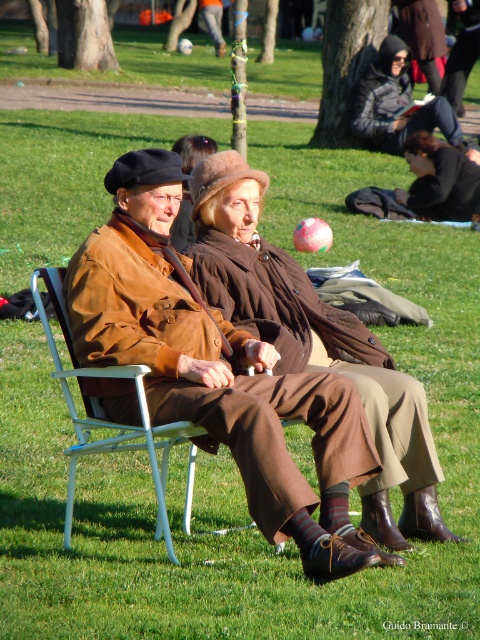
You are a photographer planning to take a group photo of the dark gray hooded jacket at center and the brown woolen coat at center. Since you want to emphasize their size difference, which one should you place closer to the camera to make them appear the same size in the photo?

To make the dark gray hooded jacket at center and the brown woolen coat at center appear the same size in the photo, place the smaller brown woolen coat at center closer to the camera since it is smaller than the larger dark gray hooded jacket at center.

You are standing in the park and see two points marked in the image. Which point is closer to you, point (x=400, y=38) or point (x=422, y=205)?

Point (x=400, y=38) is closer to you because it is further to the viewer than point (x=422, y=205).

You are a photographer standing at the edge of the park. You want to capture a photo of both the dark gray hooded jacket at center and the brown woolen coat at center in the same frame. The camera you are using has a maximum focus range of 10 meters. Will you be able to include both subjects in the photo without moving closer?

The distance between the dark gray hooded jacket at center and the brown woolen coat at center is 9.60 meters, which is within the camera maximum focus range of 10 meters. Therefore, you can include both subjects in the photo without moving closer.